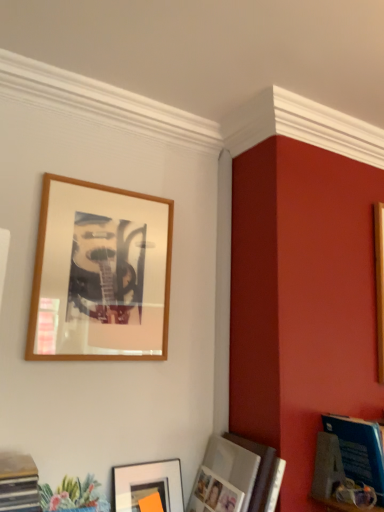
Measure the distance between matte silver photo frame at lower right, the 2th picture frame when ordered from top to bottom, and camera.

matte silver photo frame at lower right, the 2th picture frame when ordered from top to bottom, is 1.21 meters from camera.

Describe the element at coordinates (100, 274) in the screenshot. This screenshot has width=384, height=512. I see `wooden frame at upper left, positioned as the first picture frame in top-to-bottom order` at that location.

What do you see at coordinates (359, 450) in the screenshot? I see `blue glossy magazine at lower right` at bounding box center [359, 450].

This screenshot has height=512, width=384. I want to click on matte silver photo frame at lower right, which ranks as the 2th picture frame in bottom-to-top order, so click(237, 477).

Where is `magazine above the matte silver photo frame at lower right, the 2th picture frame when ordered from top to bottom (from a real-world perspective)`? The width and height of the screenshot is (384, 512). magazine above the matte silver photo frame at lower right, the 2th picture frame when ordered from top to bottom (from a real-world perspective) is located at coordinates (359, 450).

Is matte silver photo frame at lower right, the 2th picture frame when ordered from top to bottom, facing away from blue glossy magazine at lower right?

No, matte silver photo frame at lower right, the 2th picture frame when ordered from top to bottom, is not facing away from blue glossy magazine at lower right.

Is matte silver photo frame at lower right, the 2th picture frame when ordered from top to bottom, in front of or behind blue glossy magazine at lower right in the image?

Clearly, matte silver photo frame at lower right, the 2th picture frame when ordered from top to bottom, is in front of blue glossy magazine at lower right.

Is matte silver photo frame at lower right, which ranks as the 2th picture frame in bottom-to-top order, far away from blue glossy magazine at lower right?

No, matte silver photo frame at lower right, which ranks as the 2th picture frame in bottom-to-top order, is in close proximity to blue glossy magazine at lower right.

Is wooden frame at upper left, arranged as the 3th picture frame when ordered from the bottom, positioned with its back to blue glossy magazine at lower right?

wooden frame at upper left, arranged as the 3th picture frame when ordered from the bottom, does not have its back to blue glossy magazine at lower right.

From the image's perspective, is wooden frame at upper left, arranged as the 3th picture frame when ordered from the bottom, on blue glossy magazine at lower right?

Indeed, from the image's perspective, wooden frame at upper left, arranged as the 3th picture frame when ordered from the bottom, is shown above blue glossy magazine at lower right.

In terms of size, does wooden frame at upper left, positioned as the first picture frame in top-to-bottom order, appear bigger or smaller than blue glossy magazine at lower right?

wooden frame at upper left, positioned as the first picture frame in top-to-bottom order, is smaller than blue glossy magazine at lower right.

Which is nearer, (x=67, y=178) or (x=376, y=476)?

The point (x=376, y=476) is in front.

Considering the positions of objects blue glossy magazine at lower right and matte black picture frame at lower center, which is counted as the third picture frame, starting from the top, in the image provided, who is behind, blue glossy magazine at lower right or matte black picture frame at lower center, which is counted as the third picture frame, starting from the top,?

Positioned behind is matte black picture frame at lower center, which is counted as the third picture frame, starting from the top.

Is matte black picture frame at lower center, which appears as the 1th picture frame when ordered from the bottom, located within blue glossy magazine at lower right?

No, matte black picture frame at lower center, which appears as the 1th picture frame when ordered from the bottom, is not surrounded by blue glossy magazine at lower right.

Is blue glossy magazine at lower right bigger or smaller than matte black picture frame at lower center, which is counted as the third picture frame, starting from the top?

Considering their sizes, blue glossy magazine at lower right takes up more space than matte black picture frame at lower center, which is counted as the third picture frame, starting from the top.

Where is `magazine positioned vertically above the matte black picture frame at lower center, which appears as the 1th picture frame when ordered from the bottom (from a real-world perspective)`? Image resolution: width=384 pixels, height=512 pixels. magazine positioned vertically above the matte black picture frame at lower center, which appears as the 1th picture frame when ordered from the bottom (from a real-world perspective) is located at coordinates pos(359,450).

Looking at this image, is matte silver photo frame at lower right, which ranks as the 2th picture frame in bottom-to-top order, facing away from wooden frame at upper left, positioned as the first picture frame in top-to-bottom order?

matte silver photo frame at lower right, which ranks as the 2th picture frame in bottom-to-top order, does not have its back to wooden frame at upper left, positioned as the first picture frame in top-to-bottom order.

Is matte silver photo frame at lower right, the 2th picture frame when ordered from top to bottom, beside wooden frame at upper left, arranged as the 3th picture frame when ordered from the bottom?

They are not placed beside each other.

Can you confirm if matte silver photo frame at lower right, which ranks as the 2th picture frame in bottom-to-top order, is bigger than wooden frame at upper left, arranged as the 3th picture frame when ordered from the bottom?

Yes.

Is point (216, 454) more distant than point (79, 349)?

Yes, point (216, 454) is farther from viewer.

Is matte black picture frame at lower center, which appears as the 1th picture frame when ordered from the bottom, bigger or smaller than blue glossy magazine at lower right?

In the image, matte black picture frame at lower center, which appears as the 1th picture frame when ordered from the bottom, appears to be smaller than blue glossy magazine at lower right.

Is matte black picture frame at lower center, which appears as the 1th picture frame when ordered from the bottom, positioned behind blue glossy magazine at lower right?

Yes, matte black picture frame at lower center, which appears as the 1th picture frame when ordered from the bottom, is further from the camera.

Looking at their sizes, would you say matte black picture frame at lower center, which appears as the 1th picture frame when ordered from the bottom, is wider or thinner than blue glossy magazine at lower right?

In the image, matte black picture frame at lower center, which appears as the 1th picture frame when ordered from the bottom, appears to be more narrow than blue glossy magazine at lower right.

Based on the photo, from a real-world perspective, does matte black picture frame at lower center, which appears as the 1th picture frame when ordered from the bottom, stand above blue glossy magazine at lower right?

Actually, matte black picture frame at lower center, which appears as the 1th picture frame when ordered from the bottom, is physically below blue glossy magazine at lower right in the real world.

Is wooden frame at upper left, positioned as the first picture frame in top-to-bottom order, taller or shorter than matte black picture frame at lower center, which is counted as the third picture frame, starting from the top?

Considering their sizes, wooden frame at upper left, positioned as the first picture frame in top-to-bottom order, has more height than matte black picture frame at lower center, which is counted as the third picture frame, starting from the top.

Does wooden frame at upper left, positioned as the first picture frame in top-to-bottom order, lie in front of matte black picture frame at lower center, which appears as the 1th picture frame when ordered from the bottom?

No, the depth of wooden frame at upper left, positioned as the first picture frame in top-to-bottom order, is greater than that of matte black picture frame at lower center, which appears as the 1th picture frame when ordered from the bottom.

Does point (152, 275) come behind point (149, 490)?

Yes, it is behind point (149, 490).

Based on their sizes in the image, would you say wooden frame at upper left, positioned as the first picture frame in top-to-bottom order, is bigger or smaller than matte black picture frame at lower center, which appears as the 1th picture frame when ordered from the bottom?

Clearly, wooden frame at upper left, positioned as the first picture frame in top-to-bottom order, is larger in size than matte black picture frame at lower center, which appears as the 1th picture frame when ordered from the bottom.

Between matte black picture frame at lower center, which appears as the 1th picture frame when ordered from the bottom, and wooden frame at upper left, positioned as the first picture frame in top-to-bottom order, which one has smaller size?

matte black picture frame at lower center, which appears as the 1th picture frame when ordered from the bottom.

Looking at this image, from a real-world perspective, is matte black picture frame at lower center, which is counted as the third picture frame, starting from the top, positioned over wooden frame at upper left, positioned as the first picture frame in top-to-bottom order, based on gravity?

Incorrect, from a real-world perspective, matte black picture frame at lower center, which is counted as the third picture frame, starting from the top, is lower than wooden frame at upper left, positioned as the first picture frame in top-to-bottom order.

How much distance is there between matte black picture frame at lower center, which is counted as the third picture frame, starting from the top, and wooden frame at upper left, positioned as the first picture frame in top-to-bottom order?

matte black picture frame at lower center, which is counted as the third picture frame, starting from the top, is 23.17 inches from wooden frame at upper left, positioned as the first picture frame in top-to-bottom order.

Is matte black picture frame at lower center, which is counted as the third picture frame, starting from the top, located outside wooden frame at upper left, positioned as the first picture frame in top-to-bottom order?

That's correct, matte black picture frame at lower center, which is counted as the third picture frame, starting from the top, is outside of wooden frame at upper left, positioned as the first picture frame in top-to-bottom order.

Locate an element on the screen. magazine to the right of matte silver photo frame at lower right, the 2th picture frame when ordered from top to bottom is located at coordinates (359, 450).

Where is `magazine below the wooden frame at upper left, positioned as the first picture frame in top-to-bottom order (from the image's perspective)`? This screenshot has width=384, height=512. magazine below the wooden frame at upper left, positioned as the first picture frame in top-to-bottom order (from the image's perspective) is located at coordinates (359, 450).

Considering their positions, is blue glossy magazine at lower right positioned closer to matte black picture frame at lower center, which appears as the 1th picture frame when ordered from the bottom, than matte silver photo frame at lower right, which ranks as the 2th picture frame in bottom-to-top order?

Based on the image, matte silver photo frame at lower right, which ranks as the 2th picture frame in bottom-to-top order, appears to be nearer to matte black picture frame at lower center, which appears as the 1th picture frame when ordered from the bottom.

From the image, which object appears to be nearer to wooden frame at upper left, positioned as the first picture frame in top-to-bottom order, matte silver photo frame at lower right, which ranks as the 2th picture frame in bottom-to-top order, or matte black picture frame at lower center, which is counted as the third picture frame, starting from the top?

Based on the image, matte black picture frame at lower center, which is counted as the third picture frame, starting from the top, appears to be nearer to wooden frame at upper left, positioned as the first picture frame in top-to-bottom order.

Considering their positions, is matte silver photo frame at lower right, the 2th picture frame when ordered from top to bottom, positioned closer to blue glossy magazine at lower right than wooden frame at upper left, arranged as the 3th picture frame when ordered from the bottom?

matte silver photo frame at lower right, the 2th picture frame when ordered from top to bottom, lies closer to blue glossy magazine at lower right than the other object.

Considering their positions, is blue glossy magazine at lower right positioned further to matte black picture frame at lower center, which appears as the 1th picture frame when ordered from the bottom, than wooden frame at upper left, arranged as the 3th picture frame when ordered from the bottom?

blue glossy magazine at lower right lies further to matte black picture frame at lower center, which appears as the 1th picture frame when ordered from the bottom, than the other object.

From the image, which object appears to be farther from matte black picture frame at lower center, which is counted as the third picture frame, starting from the top, matte silver photo frame at lower right, the 2th picture frame when ordered from top to bottom, or wooden frame at upper left, positioned as the first picture frame in top-to-bottom order?

wooden frame at upper left, positioned as the first picture frame in top-to-bottom order, lies further to matte black picture frame at lower center, which is counted as the third picture frame, starting from the top, than the other object.

From the image, which object appears to be nearer to wooden frame at upper left, arranged as the 3th picture frame when ordered from the bottom, matte black picture frame at lower center, which is counted as the third picture frame, starting from the top, or matte silver photo frame at lower right, which ranks as the 2th picture frame in bottom-to-top order?

matte black picture frame at lower center, which is counted as the third picture frame, starting from the top, is positioned closer to the anchor wooden frame at upper left, arranged as the 3th picture frame when ordered from the bottom.

Which object lies nearer to the anchor point matte silver photo frame at lower right, the 2th picture frame when ordered from top to bottom, matte black picture frame at lower center, which is counted as the third picture frame, starting from the top, or wooden frame at upper left, arranged as the 3th picture frame when ordered from the bottom?

matte black picture frame at lower center, which is counted as the third picture frame, starting from the top, lies closer to matte silver photo frame at lower right, the 2th picture frame when ordered from top to bottom, than the other object.

Based on the photo, from the image, which object appears to be farther from matte black picture frame at lower center, which is counted as the third picture frame, starting from the top, wooden frame at upper left, positioned as the first picture frame in top-to-bottom order, or matte silver photo frame at lower right, which ranks as the 2th picture frame in bottom-to-top order?

wooden frame at upper left, positioned as the first picture frame in top-to-bottom order, lies further to matte black picture frame at lower center, which is counted as the third picture frame, starting from the top, than the other object.

You are a GUI agent. You are given a task and a screenshot of the screen. Output one action in this format:
    pyautogui.click(x=<x>, y=<y>)
    Task: Click on the picture frame between wooden frame at upper left, arranged as the 3th picture frame when ordered from the bottom, and matte black picture frame at lower center, which appears as the 1th picture frame when ordered from the bottom, from top to bottom
    The image size is (384, 512).
    Given the screenshot: What is the action you would take?
    pyautogui.click(x=237, y=477)

Identify the location of picture frame between matte black picture frame at lower center, which appears as the 1th picture frame when ordered from the bottom, and blue glossy magazine at lower right. (237, 477).